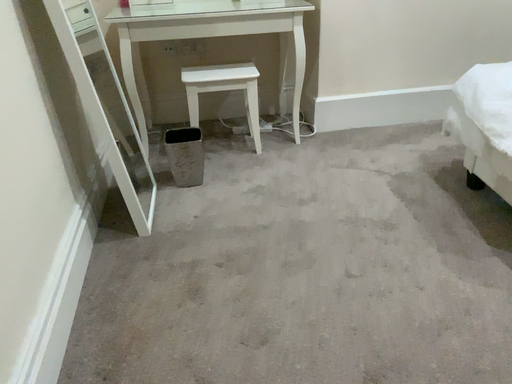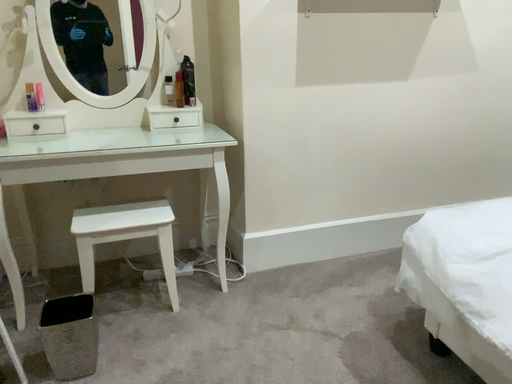
Question: Which way did the camera rotate in the video?

Choices:
 (A) rotated downward
 (B) rotated upward

Answer: (B)